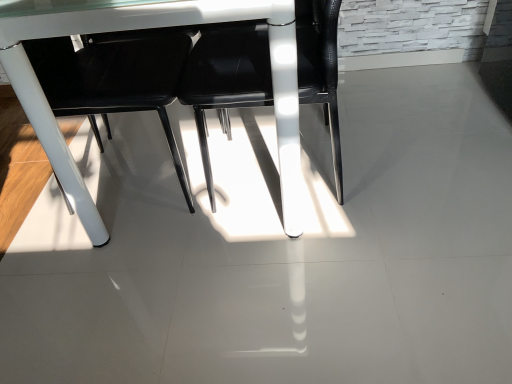
Locate an element on the screen. Image resolution: width=512 pixels, height=384 pixels. free space in front of black leather chair at center, which appears as the 2th chair when viewed from the left is located at coordinates (308, 283).